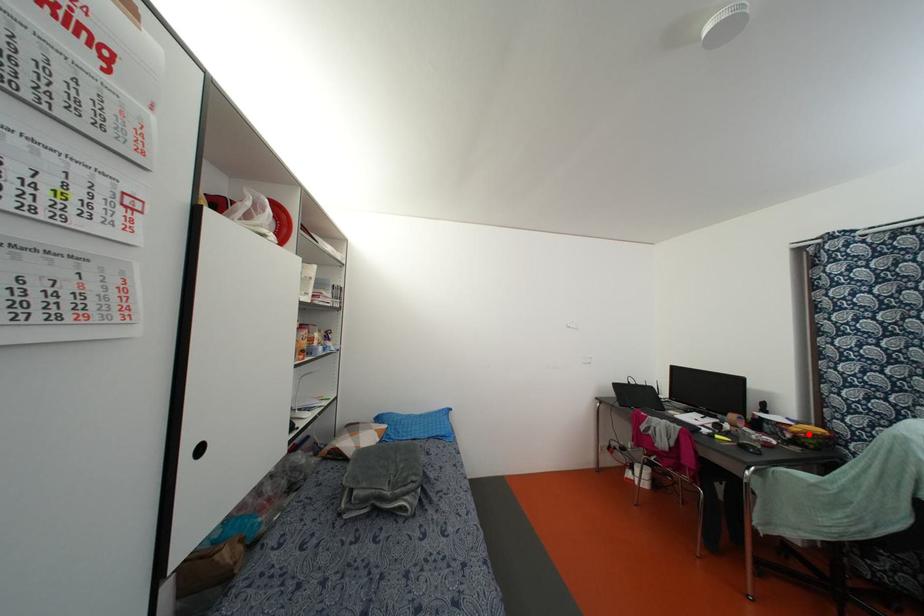
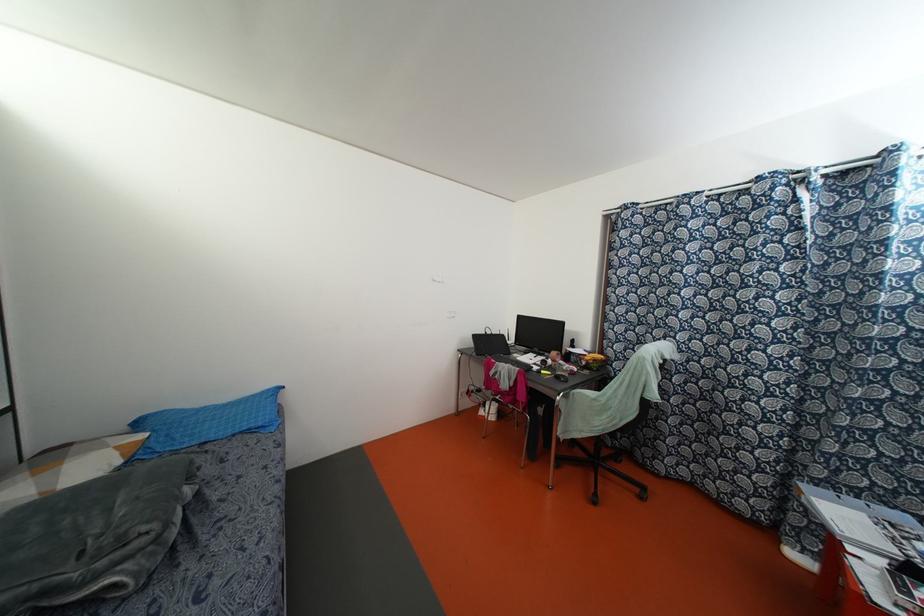
Where in the second image is the point corresponding to the highlighted location from the first image?

(593, 360)